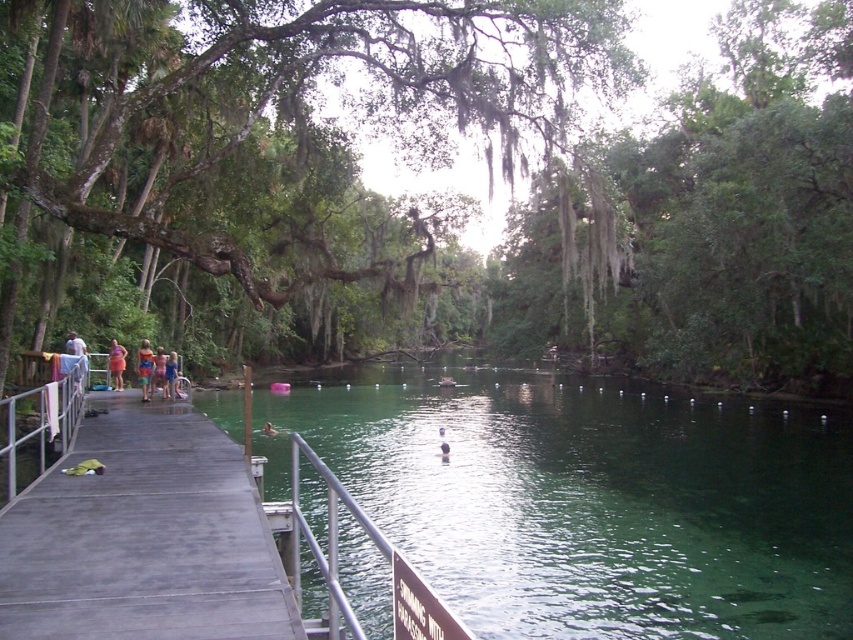
Consider the image. You are at the spring and see the orange fabric dress at left and the white cotton shirt at left. Which item is closer to the water?

The orange fabric dress at left is below the white cotton shirt at left, so it is closer to the water.

You are standing on the wooden dock and want to locate two specific points in the scene. The first point is at coordinates point (575, 403) and the second is at point (165, 376). Which of these points is closer to you?

Point (575, 403) is further to the viewer than point (165, 376), so the point (165, 376) is closer to you.

You are a photographer planning to take a photo of the blue fabric dress at center and orange fabric dress at center. Which dress should you focus on first to ensure both are in the frame without moving the camera?

You should focus on the blue fabric dress at center first because it is in front of the orange fabric dress at center, ensuring both will be captured in the frame without needing to adjust the camera position.